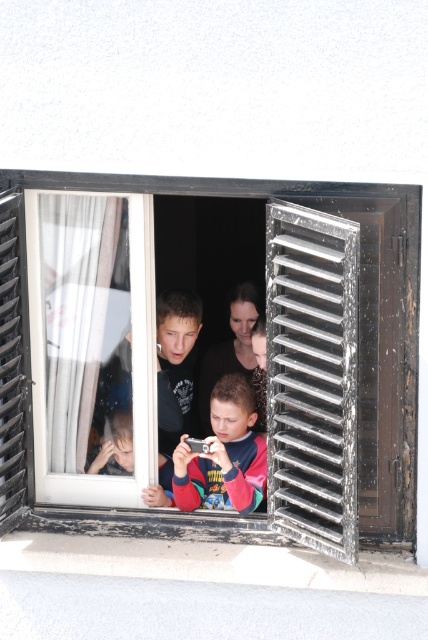
Can you confirm if metallic silver shutter at center is bigger than multicolored fabric shirt at center?

Yes, metallic silver shutter at center is bigger than multicolored fabric shirt at center.

Who is more forward, (345,534) or (249,401)?

Point (345,534) is in front.

Find the location of `metallic silver shutter at center`. metallic silver shutter at center is located at coordinates (312, 376).

Can you confirm if black matte window at center is positioned to the left of metallic silver shutter at center?

Indeed, black matte window at center is positioned on the left side of metallic silver shutter at center.

What do you see at coordinates (219, 339) in the screenshot?
I see `black matte window at center` at bounding box center [219, 339].

This screenshot has width=428, height=640. I want to click on black matte window at center, so click(219, 339).

Is white sheer curtain at center bigger than wooden textured shutter at left?

Indeed, white sheer curtain at center has a larger size compared to wooden textured shutter at left.

Does white sheer curtain at center lie in front of wooden textured shutter at left?

No, it is behind wooden textured shutter at left.

Is point (47, 362) less distant than point (0, 195)?

No, (47, 362) is behind (0, 195).

Identify the location of white sheer curtain at center. Image resolution: width=428 pixels, height=640 pixels. (80, 314).